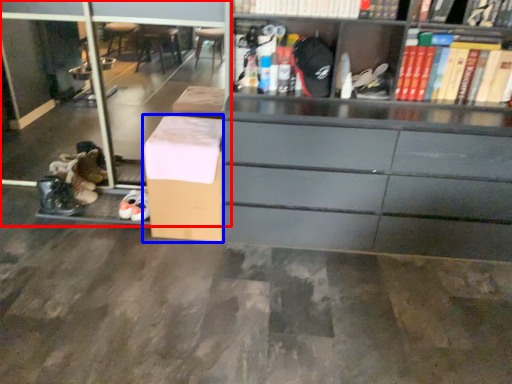
Question: Which point is further to the camera, shelf (highlighted by a red box) or cardboard box (highlighted by a blue box)?

Choices:
 (A) shelf
 (B) cardboard box

Answer: (A)